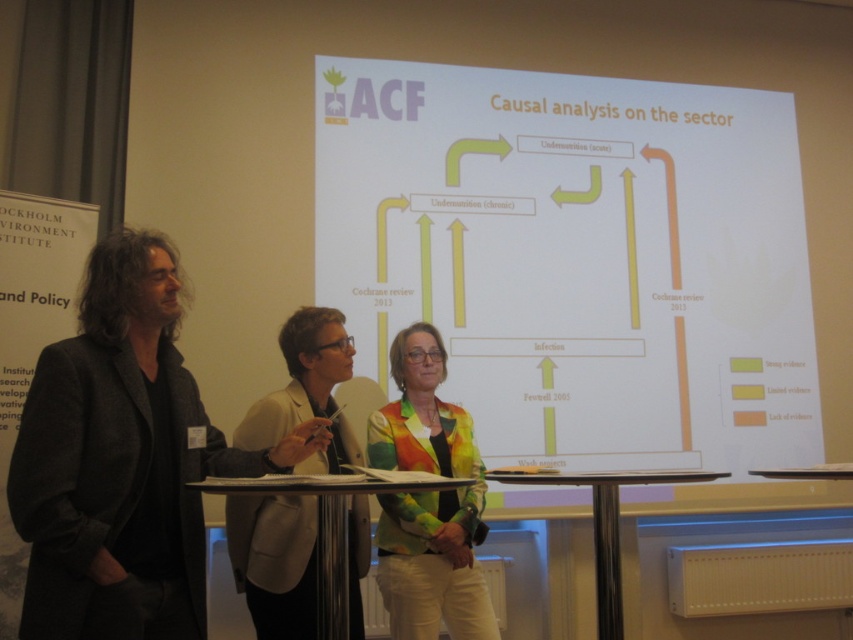
Question: Estimate the real-world distances between objects in this image. Which object is closer to the metallic silver table at center?

Choices:
 (A) white paper at center
 (B) rainbow fabric jacket at center

Answer: (B)

Question: Does dark gray woolen jacket at left appear over metallic silver table at center?

Choices:
 (A) no
 (B) yes

Answer: (B)

Question: Does metallic silver table at center appear under metallic polished table at center?

Choices:
 (A) yes
 (B) no

Answer: (B)

Question: Does rainbow fabric jacket at center appear over metallic silver table at center?

Choices:
 (A) yes
 (B) no

Answer: (A)

Question: Which point is closer to the camera?

Choices:
 (A) metallic silver table at center
 (B) metallic polished table at center

Answer: (A)

Question: Which object is positioned closest to the rainbow fabric jacket at center?

Choices:
 (A) white paper at center
 (B) metallic silver table at center

Answer: (B)